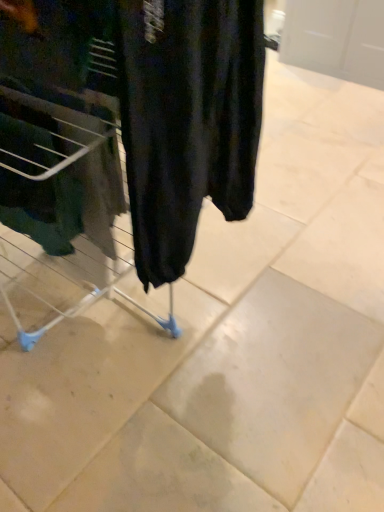
Question: Is black matte pants at center taller than metal laundry basket at left?

Choices:
 (A) yes
 (B) no

Answer: (A)

Question: Is black matte pants at center located outside metal laundry basket at left?

Choices:
 (A) no
 (B) yes

Answer: (B)

Question: Does black matte pants at center lie behind metal laundry basket at left?

Choices:
 (A) yes
 (B) no

Answer: (B)

Question: From a real-world perspective, is black matte pants at center positioned over metal laundry basket at left based on gravity?

Choices:
 (A) yes
 (B) no

Answer: (A)

Question: Is black matte pants at center beside metal laundry basket at left?

Choices:
 (A) no
 (B) yes

Answer: (A)

Question: Is metal laundry basket at left located within black matte pants at center?

Choices:
 (A) no
 (B) yes

Answer: (A)

Question: Is metal laundry basket at left bigger than black matte pants at center?

Choices:
 (A) yes
 (B) no

Answer: (B)

Question: Is metal laundry basket at left next to black matte pants at center?

Choices:
 (A) yes
 (B) no

Answer: (B)

Question: Is black matte pants at center completely or partially inside metal laundry basket at left?

Choices:
 (A) yes
 (B) no

Answer: (B)

Question: Does metal laundry basket at left have a greater height compared to black matte pants at center?

Choices:
 (A) yes
 (B) no

Answer: (B)

Question: Does metal laundry basket at left have a greater width compared to black matte pants at center?

Choices:
 (A) yes
 (B) no

Answer: (A)

Question: From a real-world perspective, is metal laundry basket at left located higher than black matte pants at center?

Choices:
 (A) yes
 (B) no

Answer: (B)

Question: Is metal laundry basket at left to the left or to the right of black matte pants at center in the image?

Choices:
 (A) left
 (B) right

Answer: (A)